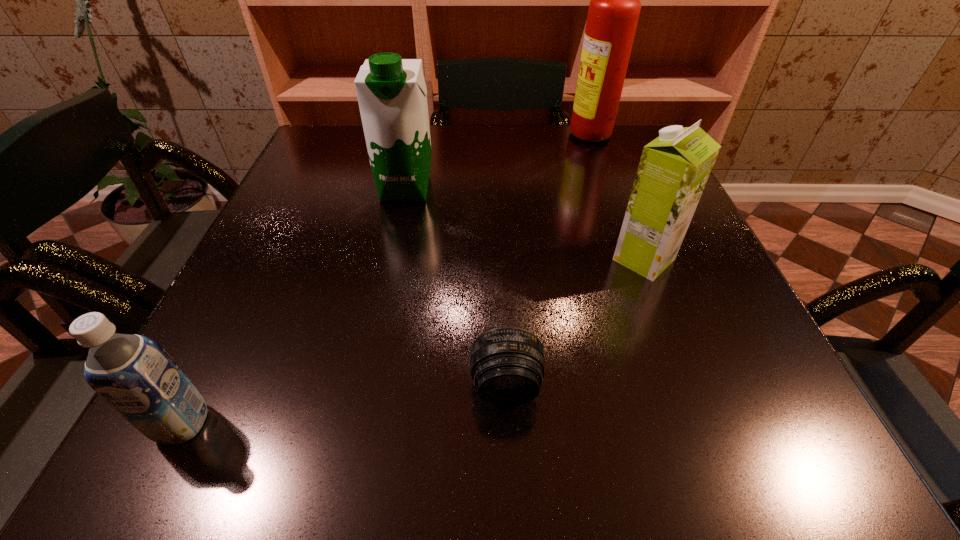
Image resolution: width=960 pixels, height=540 pixels. In the image, there is a desktop. Identify the location of vacant space at the near right corner. (765, 439).

Identify the location of vacant space that is in between the fourth object from right to left and the farthest object. This screenshot has width=960, height=540. (499, 163).

Identify the location of empty space that is in between the second shortest object and the telephoto lens. The image size is (960, 540). (344, 404).

At what (x,y) coordinates should I click in order to perform the action: click on vacant space that is in between the farthest soya milk and the farthest object. Please return your answer as a coordinate pair (x, y). Looking at the image, I should click on (499, 163).

The height and width of the screenshot is (540, 960). I want to click on vacant area between the third nearest object and the second object from left to right, so click(525, 224).

This screenshot has width=960, height=540. Find the location of `vacant space that is in between the telephoto lens and the shortest soya milk`. vacant space that is in between the telephoto lens and the shortest soya milk is located at coordinates (344, 404).

Locate an element on the screen. This screenshot has width=960, height=540. free space that is in between the telephoto lens and the tallest object is located at coordinates (549, 262).

Locate an element on the screen. vacant area that lies between the tallest object and the farthest soya milk is located at coordinates (499, 163).

Locate an element on the screen. free area in between the tallest object and the telephoto lens is located at coordinates (549, 262).

Find the location of a particular element. Image resolution: width=960 pixels, height=540 pixels. free space that is in between the fire extinguisher and the third farthest object is located at coordinates (618, 199).